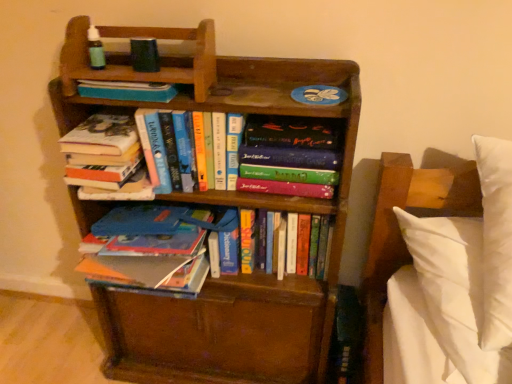
Identify the location of blank space situated above hardcover book at center, acting as the 3th book starting from the left (from a real-world perspective). (189, 108).